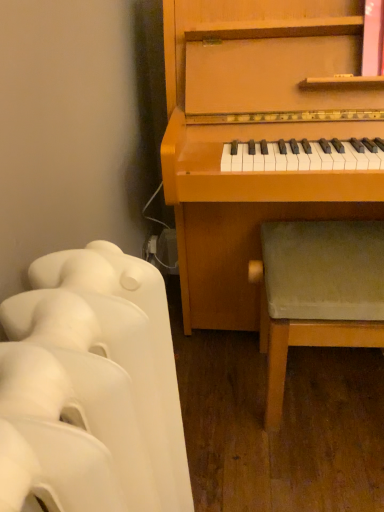
In the scene shown: What is the approximate height of white matte radiator at lower left?

white matte radiator at lower left is 80.73 centimeters tall.

This screenshot has width=384, height=512. I want to click on white matte radiator at lower left, so click(91, 389).

Describe the element at coordinates (91, 389) in the screenshot. The height and width of the screenshot is (512, 384). I see `white matte radiator at lower left` at that location.

Image resolution: width=384 pixels, height=512 pixels. Identify the location of green fabric stool at lower right. (317, 292).

Image resolution: width=384 pixels, height=512 pixels. Describe the element at coordinates (317, 292) in the screenshot. I see `green fabric stool at lower right` at that location.

Measure the distance between point (292, 298) and camera.

The depth of point (292, 298) is 36.10 inches.

Find the location of a particular element. This screenshot has width=384, height=512. white matte radiator at lower left is located at coordinates (91, 389).

Which is more to the right, green fabric stool at lower right or white matte radiator at lower left?

green fabric stool at lower right.

Relative to white matte radiator at lower left, is green fabric stool at lower right in front or behind?

In the image, green fabric stool at lower right appears behind white matte radiator at lower left.

Which is closer to the camera, (277,306) or (88,286)?

Point (277,306).

From the image's perspective, which is above, green fabric stool at lower right or white matte radiator at lower left?

From the image's view, green fabric stool at lower right is above.

From a real-world perspective, which object stands above the other?

white matte radiator at lower left.

Can you confirm if green fabric stool at lower right is thinner than white matte radiator at lower left?

No.

In the scene shown: Who is shorter, green fabric stool at lower right or white matte radiator at lower left?

green fabric stool at lower right is shorter.

Is green fabric stool at lower right bigger or smaller than white matte radiator at lower left?

In the image, green fabric stool at lower right appears to be larger than white matte radiator at lower left.

Choose the correct answer: Is green fabric stool at lower right inside white matte radiator at lower left or outside it?

The correct answer is: outside.

Consider the image. Are green fabric stool at lower right and white matte radiator at lower left far apart?

That's not correct — green fabric stool at lower right is a little close to white matte radiator at lower left.

Is green fabric stool at lower right turned away from white matte radiator at lower left?

green fabric stool at lower right does not have its back to white matte radiator at lower left.

The height and width of the screenshot is (512, 384). I want to click on furniture positioned vertically above the green fabric stool at lower right (from a real-world perspective), so click(x=91, y=389).

Does white matte radiator at lower left appear on the left side of green fabric stool at lower right?

Indeed, white matte radiator at lower left is positioned on the left side of green fabric stool at lower right.

In the scene shown: Considering the relative positions of white matte radiator at lower left and green fabric stool at lower right in the image provided, is white matte radiator at lower left in front of green fabric stool at lower right?

Yes, white matte radiator at lower left is closer to the viewer.

Is point (67, 272) closer or farther from the camera than point (283, 360)?

Point (67, 272) is positioned closer to the camera compared to point (283, 360).

From the image's perspective, which is above, white matte radiator at lower left or green fabric stool at lower right?

green fabric stool at lower right appears higher in the image.

Based on the photo, from a real-world perspective, which object rests below the other?

green fabric stool at lower right is physically lower.

Between white matte radiator at lower left and green fabric stool at lower right, which one has larger width?

green fabric stool at lower right.

From their relative heights in the image, would you say white matte radiator at lower left is taller or shorter than green fabric stool at lower right?

white matte radiator at lower left is taller than green fabric stool at lower right.

Considering the relative sizes of white matte radiator at lower left and green fabric stool at lower right in the image provided, is white matte radiator at lower left smaller than green fabric stool at lower right?

Yes.

Could green fabric stool at lower right be considered to be inside white matte radiator at lower left?

No.

Is white matte radiator at lower left far from green fabric stool at lower right?

white matte radiator at lower left is near green fabric stool at lower right, not far away.

Consider the image. Is white matte radiator at lower left turned away from green fabric stool at lower right?

No, white matte radiator at lower left is not facing the opposite direction of green fabric stool at lower right.

Where is `music stool directly beneath the white matte radiator at lower left (from a real-world perspective)`? The image size is (384, 512). music stool directly beneath the white matte radiator at lower left (from a real-world perspective) is located at coordinates (317, 292).

There is a green fabric stool at lower right. At what (x,y) coordinates should I click in order to perform the action: click on furniture above it (from a real-world perspective). Please return your answer as a coordinate pair (x, y). The height and width of the screenshot is (512, 384). Looking at the image, I should click on (91, 389).

The height and width of the screenshot is (512, 384). In order to click on music stool that is behind the white matte radiator at lower left in this screenshot , I will do `click(317, 292)`.